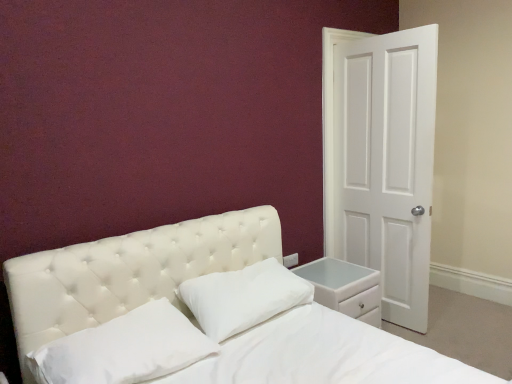
What is the approximate width of white soft pillow at center, the 1th pillow positioned from the right?

The width of white soft pillow at center, the 1th pillow positioned from the right, is 15.81 inches.

Locate an element on the screen. white soft pillow at center, which appears as the first pillow when viewed from the left is located at coordinates (124, 348).

What is the approximate width of white leather nightstand at lower right?

It is 19.45 inches.

Measure the distance between point [327,305] and camera.

Point [327,305] and camera are 7.57 feet apart from each other.

Where is `white matte door at right`? Image resolution: width=512 pixels, height=384 pixels. white matte door at right is located at coordinates (381, 160).

From a real-world perspective, is white matte door at right positioned over white soft pillow at center, the 1th pillow positioned from the right, based on gravity?

Yes, from a real-world perspective, white matte door at right is over white soft pillow at center, the 1th pillow positioned from the right

Looking at the image, does white matte door at right seem bigger or smaller compared to white soft pillow at center, the 1th pillow positioned from the right?

Considering their sizes, white matte door at right takes up more space than white soft pillow at center, the 1th pillow positioned from the right.

How different are the orientations of white matte door at right and white soft pillow at center, which is the 2th pillow from left to right, in degrees?

90.4 degrees separate the facing orientations of white matte door at right and white soft pillow at center, which is the 2th pillow from left to right.

Is white matte door at right outside of white soft pillow at center, the 1th pillow positioned from the right?

white matte door at right lies outside white soft pillow at center, the 1th pillow positioned from the right,'s area.

Consider the image. What's the angular difference between white matte door at right and white soft pillow at center, the second pillow in the right-to-left sequence,'s facing directions?

The facing directions of white matte door at right and white soft pillow at center, the second pillow in the right-to-left sequence, are 90.4 degrees apart.

In the scene shown: Does white matte door at right have a larger size compared to white soft pillow at center, the second pillow in the right-to-left sequence?

Correct, white matte door at right is larger in size than white soft pillow at center, the second pillow in the right-to-left sequence.

Does white matte door at right have a greater width compared to white soft pillow at center, which appears as the first pillow when viewed from the left?

Incorrect, the width of white matte door at right does not surpass that of white soft pillow at center, which appears as the first pillow when viewed from the left.

Is white matte door at right far from white soft pillow at center, the second pillow in the right-to-left sequence?

Yes.

Which is more to the left, white leather nightstand at lower right or white soft pillow at center, which appears as the first pillow when viewed from the left?

Positioned to the left is white soft pillow at center, which appears as the first pillow when viewed from the left.

Are white leather nightstand at lower right and white soft pillow at center, the second pillow in the right-to-left sequence, located far from each other?

Yes, white leather nightstand at lower right and white soft pillow at center, the second pillow in the right-to-left sequence, are located far from each other.

Looking at this image, between white leather nightstand at lower right and white soft pillow at center, the second pillow in the right-to-left sequence, which one has larger size?

white leather nightstand at lower right.

Does white leather nightstand at lower right have a greater height compared to white soft pillow at center, the second pillow in the right-to-left sequence?

Correct, white leather nightstand at lower right is much taller as white soft pillow at center, the second pillow in the right-to-left sequence.

Considering the sizes of objects white soft pillow at center, which is the 2th pillow from left to right, and white leather nightstand at lower right in the image provided, who is smaller, white soft pillow at center, which is the 2th pillow from left to right, or white leather nightstand at lower right?

→ white soft pillow at center, which is the 2th pillow from left to right, is smaller.

Is point (246, 294) closer or farther from the camera than point (367, 289)?

Point (246, 294) appears to be closer to the viewer than point (367, 289).

Does white soft pillow at center, the 1th pillow positioned from the right, turn towards white leather nightstand at lower right?

No, white soft pillow at center, the 1th pillow positioned from the right, does not turn towards white leather nightstand at lower right.

How many degrees apart are the facing directions of white soft pillow at center, the second pillow in the right-to-left sequence, and white leather nightstand at lower right?

0.761 degrees separate the facing orientations of white soft pillow at center, the second pillow in the right-to-left sequence, and white leather nightstand at lower right.

From a real-world perspective, is white soft pillow at center, which appears as the first pillow when viewed from the left, positioned above or below white leather nightstand at lower right?

In terms of real-world spatial position, white soft pillow at center, which appears as the first pillow when viewed from the left, is above white leather nightstand at lower right.

Consider the image. Is white soft pillow at center, which appears as the first pillow when viewed from the left, oriented away from white leather nightstand at lower right?

white soft pillow at center, which appears as the first pillow when viewed from the left, is not turned away from white leather nightstand at lower right.

From the image's perspective, is white soft pillow at center, which appears as the first pillow when viewed from the left, above or below white leather nightstand at lower right?

Based on their image positions, white soft pillow at center, which appears as the first pillow when viewed from the left, is located above white leather nightstand at lower right.

Is point (266, 278) less distant than point (149, 320)?

No, (266, 278) is behind (149, 320).

Considering their positions, is white soft pillow at center, which is the 2th pillow from left to right, located in front of or behind white soft pillow at center, the second pillow in the right-to-left sequence?

In the image, white soft pillow at center, which is the 2th pillow from left to right, appears behind white soft pillow at center, the second pillow in the right-to-left sequence.

In the scene shown: Are white soft pillow at center, which is the 2th pillow from left to right, and white soft pillow at center, which appears as the first pillow when viewed from the left, beside each other?

No.

Considering the positions of point (166, 346) and point (200, 314), is point (166, 346) closer or farther from the camera than point (200, 314)?

Point (166, 346) is closer to the camera than point (200, 314).

From a real-world perspective, is white soft pillow at center, which appears as the first pillow when viewed from the left, positioned over white soft pillow at center, which is the 2th pillow from left to right, based on gravity?

Actually, white soft pillow at center, which appears as the first pillow when viewed from the left, is physically below white soft pillow at center, which is the 2th pillow from left to right, in the real world.

From the image's perspective, which one is positioned lower, white soft pillow at center, the second pillow in the right-to-left sequence, or white soft pillow at center, the 1th pillow positioned from the right?

white soft pillow at center, the second pillow in the right-to-left sequence, from the image's perspective.

At what (x,y) coordinates should I click in order to perform the action: click on door behind the white soft pillow at center, which is the 2th pillow from left to right. Please return your answer as a coordinate pair (x, y). Looking at the image, I should click on (381, 160).

At what (x,y) coordinates should I click in order to perform the action: click on the 2nd pillow below when counting from the white matte door at right (from the image's perspective). Please return your answer as a coordinate pair (x, y). Looking at the image, I should click on (124, 348).

Based on the photo, from the image, which object appears to be farther from white leather nightstand at lower right, white soft pillow at center, which is the 2th pillow from left to right, or white soft pillow at center, the second pillow in the right-to-left sequence?

Based on the image, white soft pillow at center, the second pillow in the right-to-left sequence, appears to be further to white leather nightstand at lower right.

When comparing their distances from white soft pillow at center, which appears as the first pillow when viewed from the left, does white leather nightstand at lower right or white matte door at right seem further?

white matte door at right lies further to white soft pillow at center, which appears as the first pillow when viewed from the left, than the other object.

Looking at the image, which one is located closer to white soft pillow at center, the 1th pillow positioned from the right, white soft pillow at center, the second pillow in the right-to-left sequence, or white leather nightstand at lower right?

white soft pillow at center, the second pillow in the right-to-left sequence, lies closer to white soft pillow at center, the 1th pillow positioned from the right, than the other object.

From the picture: From the image, which object appears to be farther from white leather nightstand at lower right, white soft pillow at center, which appears as the first pillow when viewed from the left, or white matte door at right?

white soft pillow at center, which appears as the first pillow when viewed from the left, lies further to white leather nightstand at lower right than the other object.

Looking at the image, which one is located further to white leather nightstand at lower right, white matte door at right or white soft pillow at center, the second pillow in the right-to-left sequence?

Among the two, white soft pillow at center, the second pillow in the right-to-left sequence, is located further to white leather nightstand at lower right.

Looking at the image, which one is located closer to white soft pillow at center, which appears as the first pillow when viewed from the left, white leather nightstand at lower right or white soft pillow at center, which is the 2th pillow from left to right?

Based on the image, white soft pillow at center, which is the 2th pillow from left to right, appears to be nearer to white soft pillow at center, which appears as the first pillow when viewed from the left.

Which object lies nearer to the anchor point white matte door at right, white soft pillow at center, the second pillow in the right-to-left sequence, or white leather nightstand at lower right?

The object closer to white matte door at right is white leather nightstand at lower right.

Estimate the real-world distances between objects in this image. Which object is closer to white soft pillow at center, the second pillow in the right-to-left sequence, white matte door at right or white leather nightstand at lower right?

white leather nightstand at lower right.

Where is `nightstand located between white soft pillow at center, which is the 2th pillow from left to right, and white matte door at right in the left-right direction`? The width and height of the screenshot is (512, 384). nightstand located between white soft pillow at center, which is the 2th pillow from left to right, and white matte door at right in the left-right direction is located at coordinates (345, 288).

You are a GUI agent. You are given a task and a screenshot of the screen. Output one action in this format:
    pyautogui.click(x=<x>, y=<y>)
    Task: Click on the nightstand located between white soft pillow at center, the second pillow in the right-to-left sequence, and white matte door at right in the left-right direction
    
    Given the screenshot: What is the action you would take?
    pyautogui.click(x=345, y=288)

The image size is (512, 384). Identify the location of pillow between white soft pillow at center, the second pillow in the right-to-left sequence, and white leather nightstand at lower right from front to back. (243, 297).

Where is `pillow between white soft pillow at center, which appears as the first pillow when viewed from the left, and white matte door at right from left to right`? Image resolution: width=512 pixels, height=384 pixels. pillow between white soft pillow at center, which appears as the first pillow when viewed from the left, and white matte door at right from left to right is located at coordinates (243, 297).